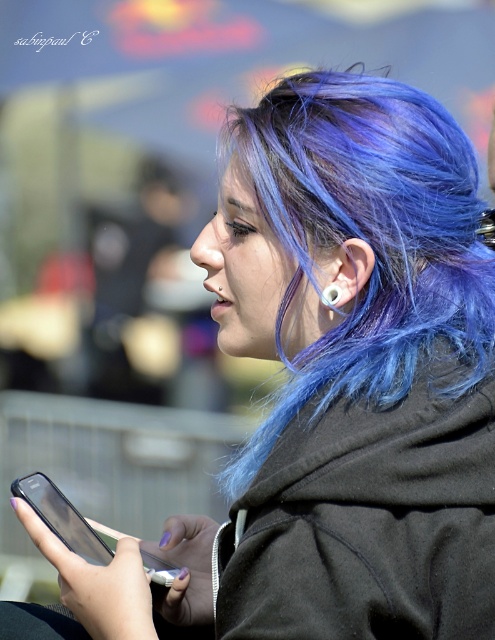
Who is positioned more to the right, blue dyed hair at center or silver metallic earring at ear?

silver metallic earring at ear

Is blue dyed hair at center taller than silver metallic earring at ear?

Yes, blue dyed hair at center is taller than silver metallic earring at ear.

Where is `blue dyed hair at center`? This screenshot has width=495, height=640. blue dyed hair at center is located at coordinates (366, 237).

The width and height of the screenshot is (495, 640). In order to click on blue dyed hair at center in this screenshot , I will do `click(366, 237)`.